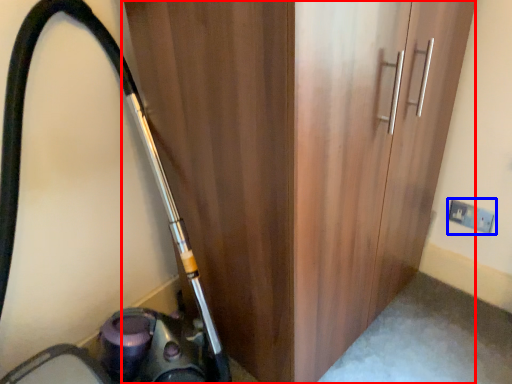
Question: Which point is closer to the camera, door (highlighted by a red box) or electric outlet (highlighted by a blue box)?

Choices:
 (A) door
 (B) electric outlet

Answer: (A)